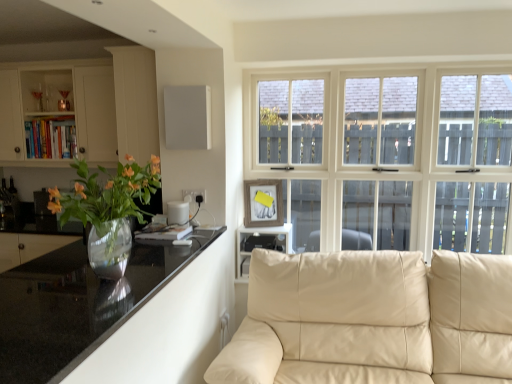
Question: Is beige leather couch at lower right bigger than black plastic shelf at center?

Choices:
 (A) no
 (B) yes

Answer: (B)

Question: Considering the relative sizes of beige leather couch at lower right and black plastic shelf at center in the image provided, is beige leather couch at lower right wider than black plastic shelf at center?

Choices:
 (A) no
 (B) yes

Answer: (B)

Question: Is beige leather couch at lower right located outside black plastic shelf at center?

Choices:
 (A) yes
 (B) no

Answer: (A)

Question: Is beige leather couch at lower right thinner than black plastic shelf at center?

Choices:
 (A) yes
 (B) no

Answer: (B)

Question: From a real-world perspective, does beige leather couch at lower right sit lower than black plastic shelf at center?

Choices:
 (A) no
 (B) yes

Answer: (B)

Question: Does beige leather couch at lower right appear on the right side of black plastic shelf at center?

Choices:
 (A) no
 (B) yes

Answer: (B)

Question: Is matte white cabinet at left closer to camera compared to black plastic shelf at center?

Choices:
 (A) yes
 (B) no

Answer: (B)

Question: Could you tell me if matte white cabinet at left is turned towards black plastic shelf at center?

Choices:
 (A) yes
 (B) no

Answer: (B)

Question: From a real-world perspective, is matte white cabinet at left positioned under black plastic shelf at center based on gravity?

Choices:
 (A) no
 (B) yes

Answer: (A)

Question: Is black plastic shelf at center at the back of matte white cabinet at left?

Choices:
 (A) no
 (B) yes

Answer: (A)

Question: From the image's perspective, is matte white cabinet at left under black plastic shelf at center?

Choices:
 (A) no
 (B) yes

Answer: (A)

Question: Are matte white cabinet at left and black plastic shelf at center beside each other?

Choices:
 (A) no
 (B) yes

Answer: (A)

Question: Does black plastic shelf at center appear on the left side of translucent glass vase at left?

Choices:
 (A) no
 (B) yes

Answer: (A)